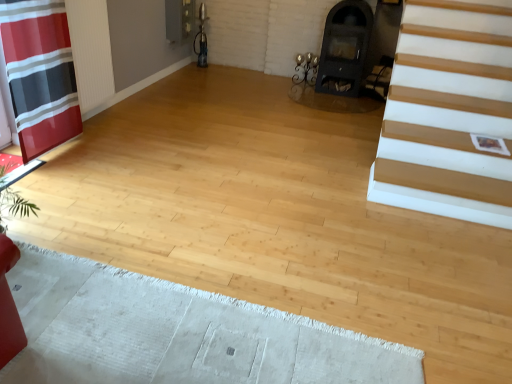
Question: Does white textured rug at lower left have a lesser height compared to black matte fireplace at upper center?

Choices:
 (A) no
 (B) yes

Answer: (B)

Question: Is white textured rug at lower left surrounding black matte fireplace at upper center?

Choices:
 (A) no
 (B) yes

Answer: (A)

Question: Can you confirm if white textured rug at lower left is positioned to the right of black matte fireplace at upper center?

Choices:
 (A) no
 (B) yes

Answer: (A)

Question: From the image's perspective, does white textured rug at lower left appear higher than black matte fireplace at upper center?

Choices:
 (A) no
 (B) yes

Answer: (A)

Question: Considering the relative sizes of white textured rug at lower left and black matte fireplace at upper center in the image provided, is white textured rug at lower left bigger than black matte fireplace at upper center?

Choices:
 (A) yes
 (B) no

Answer: (B)

Question: From the image's perspective, is red striped fabric at left positioned above or below matte black armchair at center?

Choices:
 (A) below
 (B) above

Answer: (A)

Question: Is point (24, 152) positioned closer to the camera than point (384, 59)?

Choices:
 (A) farther
 (B) closer

Answer: (B)

Question: Relative to matte black armchair at center, is red striped fabric at left in front or behind?

Choices:
 (A) behind
 (B) front

Answer: (B)

Question: In terms of width, does red striped fabric at left look wider or thinner when compared to matte black armchair at center?

Choices:
 (A) thin
 (B) wide

Answer: (A)

Question: Is black matte fireplace at upper center inside the boundaries of matte black armchair at center, or outside?

Choices:
 (A) inside
 (B) outside

Answer: (B)

Question: Is black matte fireplace at upper center in front of or behind matte black armchair at center in the image?

Choices:
 (A) front
 (B) behind

Answer: (A)

Question: From a real-world perspective, is black matte fireplace at upper center physically located above or below matte black armchair at center?

Choices:
 (A) above
 (B) below

Answer: (A)

Question: From the image's perspective, is black matte fireplace at upper center positioned above or below matte black armchair at center?

Choices:
 (A) above
 (B) below

Answer: (A)

Question: Is red striped fabric at left in front of or behind black matte fireplace at upper center in the image?

Choices:
 (A) behind
 (B) front

Answer: (B)

Question: Looking at their shapes, would you say red striped fabric at left is wider or thinner than black matte fireplace at upper center?

Choices:
 (A) wide
 (B) thin

Answer: (B)